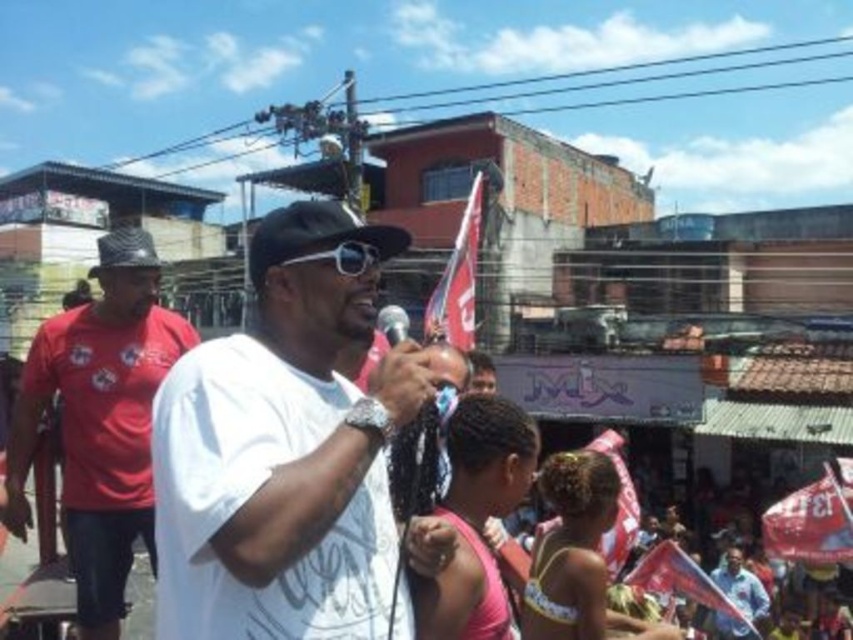
You are at an outdoor event and see two people wearing baseball caps. One is wearing a black matte baseball cap at center and another is wearing a matte black baseball cap at left. Which one is positioned to the right of the other?

The black matte baseball cap at center is positioned to the right of the matte black baseball cap at left.

You are standing in the crowd at the event and want to get a better view of the performer. There are two spots marked by points in the image. Point A is at coordinates point(264,248) and Point B is at point(134,257). Which point would give you a better view of the performer?

Point A at point(264,248) is closer to the viewer than point(134,257), so standing at Point A would provide a better view of the performer since it is nearer to you.

You are standing in the crowd at this event and want to get a closer look at the dark brown hair at center. If you walk directly towards it, how far will you have to walk?

The dark brown hair at center and the viewer are 73.87 feet apart from each other, so you would need to walk approximately 73.87 feet forward to reach it.